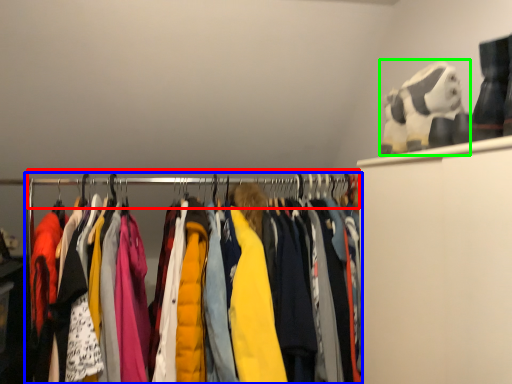
Question: Which is farther away from clothesline (highlighted by a red box)? closet (highlighted by a blue box) or toy (highlighted by a green box)?

Choices:
 (A) closet
 (B) toy

Answer: (B)